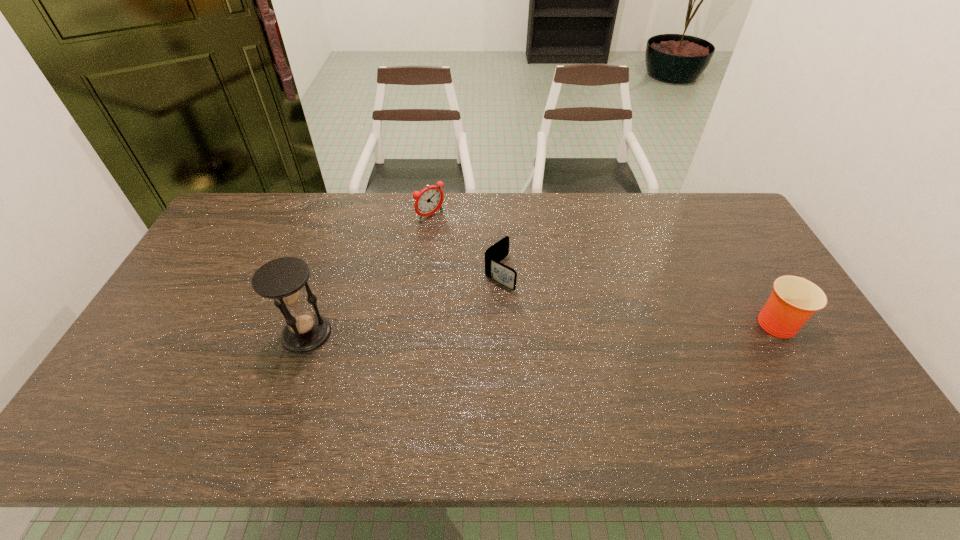
In the image, there is a desktop. At what (x,y) coordinates should I click in order to perform the action: click on free space at the right edge. Please return your answer as a coordinate pair (x, y). Looking at the image, I should click on click(x=725, y=266).

This screenshot has width=960, height=540. In order to click on vacant space at the far left corner of the desktop in this screenshot , I will do point(253,195).

You are a GUI agent. You are given a task and a screenshot of the screen. Output one action in this format:
    pyautogui.click(x=<x>, y=<y>)
    Task: Click on the vacant space at the near right corner of the desktop
    This screenshot has width=960, height=540.
    Given the screenshot: What is the action you would take?
    pyautogui.click(x=829, y=389)

The height and width of the screenshot is (540, 960). I want to click on vacant space in between the farthest object and the cup, so click(603, 268).

Where is `free space between the leftmost object and the rightmost object`? The height and width of the screenshot is (540, 960). free space between the leftmost object and the rightmost object is located at coordinates (541, 327).

At what (x,y) coordinates should I click in order to perform the action: click on vacant area between the farthest object and the tallest object. Please return your answer as a coordinate pair (x, y). This screenshot has height=540, width=960. Looking at the image, I should click on (369, 275).

The width and height of the screenshot is (960, 540). What are the coordinates of `free space that is in between the rightmost object and the tallest object` in the screenshot? It's located at (541, 327).

Locate an element on the screen. Image resolution: width=960 pixels, height=540 pixels. empty space between the tallest object and the farthest object is located at coordinates (369, 275).

The height and width of the screenshot is (540, 960). In order to click on free space between the leftmost object and the third object from left to right in this screenshot , I will do `click(403, 303)`.

Where is `vacant area that lies between the cup and the hourglass`? Image resolution: width=960 pixels, height=540 pixels. vacant area that lies between the cup and the hourglass is located at coordinates (541, 327).